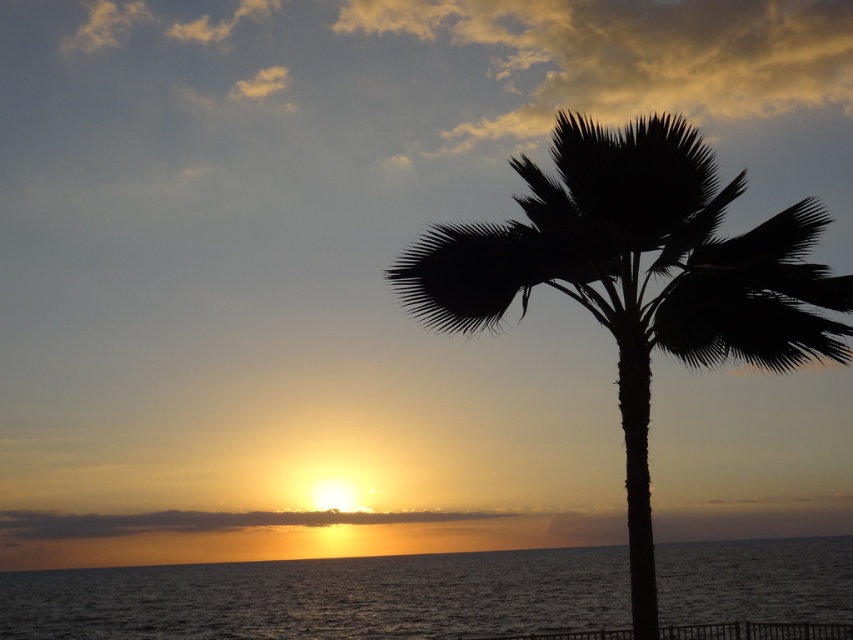
Question: Is black silhouette palm tree at center closer to the viewer compared to silvery water at lower center?

Choices:
 (A) yes
 (B) no

Answer: (A)

Question: Does black silhouette palm tree at center have a greater width compared to silvery water at lower center?

Choices:
 (A) yes
 (B) no

Answer: (B)

Question: Which object appears closest to the camera in this image?

Choices:
 (A) silvery water at lower center
 (B) black silhouette palm tree at center

Answer: (B)

Question: Does black silhouette palm tree at center come in front of silvery water at lower center?

Choices:
 (A) no
 (B) yes

Answer: (B)